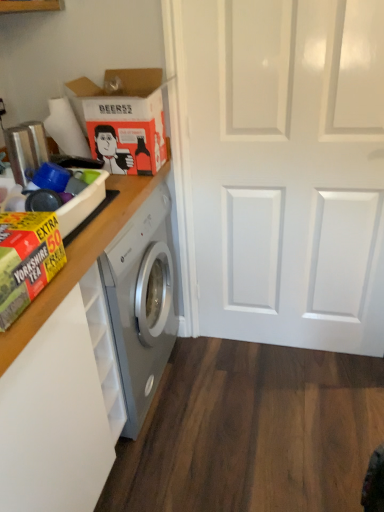
Question: Would you say yellow-green cardboard box at left, marked as the second cardboard box in a top-to-bottom arrangement, is to the left or to the right of yellow cardboard box at left in the picture?

Choices:
 (A) right
 (B) left

Answer: (A)

Question: From the image's perspective, relative to yellow cardboard box at left, is yellow-green cardboard box at left, the second cardboard box when ordered from back to front, above or below?

Choices:
 (A) above
 (B) below

Answer: (B)

Question: Which of these objects is positioned farthest from the yellow-green cardboard box at left, the 1th cardboard box when ordered from bottom to top?

Choices:
 (A) wooden counter at left
 (B) yellow cardboard box at left
 (C) white glossy door at center
 (D) orange matte cardboard box at upper left, the 2th cardboard box in the front-to-back sequence

Answer: (C)

Question: Based on their relative distances, which object is nearer to the wooden counter at left?

Choices:
 (A) yellow-green cardboard box at left, the 1th cardboard box when ordered from bottom to top
 (B) yellow cardboard box at left
 (C) white glossy door at center
 (D) orange matte cardboard box at upper left, marked as the first cardboard box in a top-to-bottom arrangement

Answer: (B)